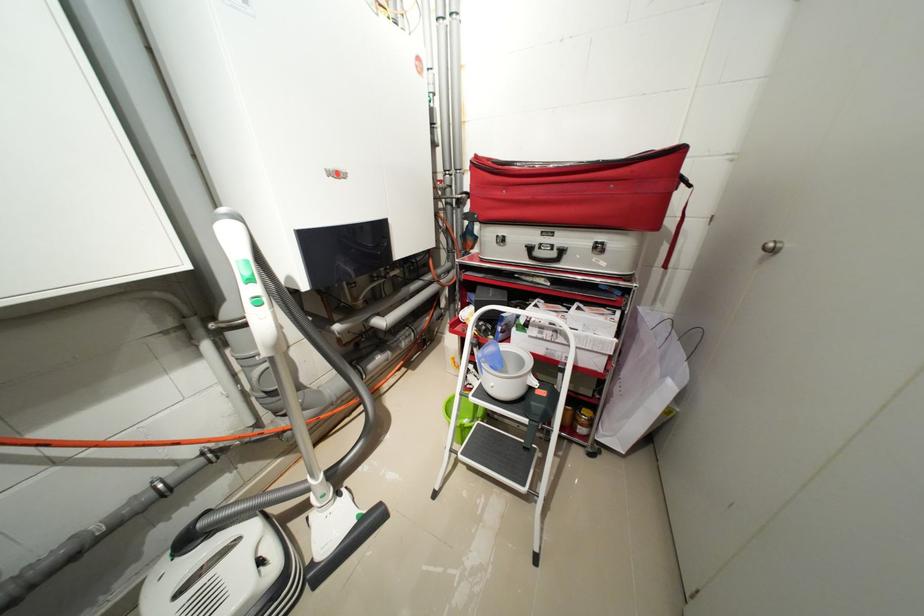
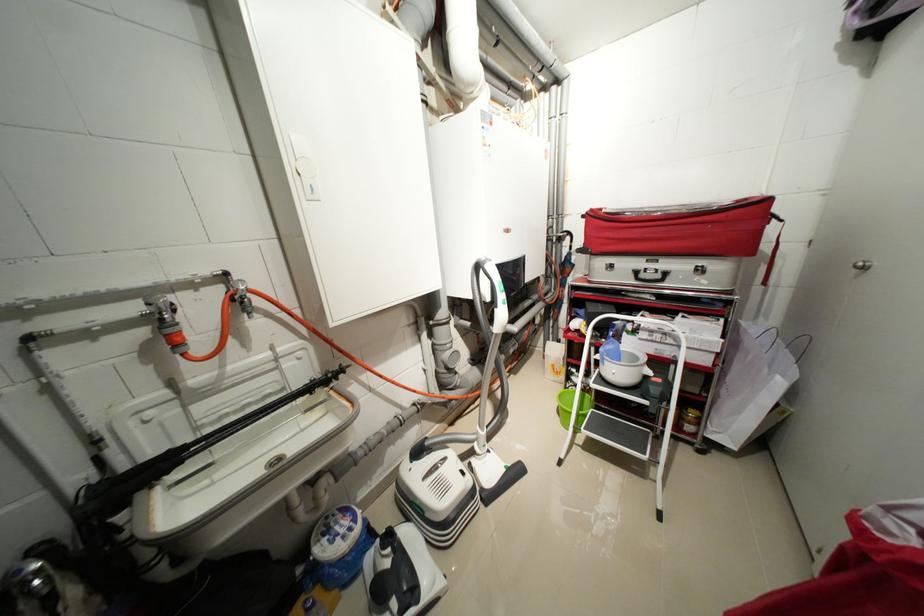
Where in the second image is the point corresponding to (x=529, y=363) from the first image?

(642, 359)